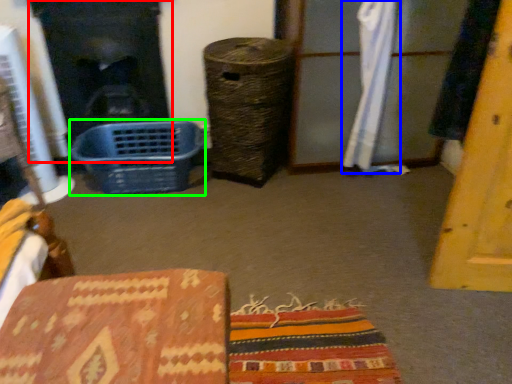
Question: Which object is the closest to the fireplace (highlighted by a red box)? Choose among these: curtain (highlighted by a blue box) or basket (highlighted by a green box).

Choices:
 (A) curtain
 (B) basket

Answer: (B)